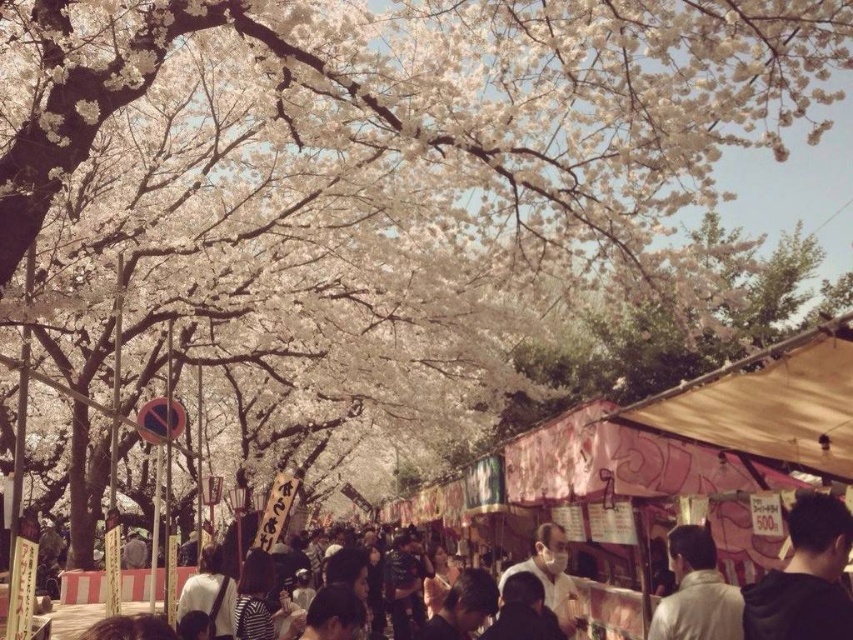
Question: Considering the real-world distances, which object is closest to the black matte hair at lower right?

Choices:
 (A) matte black mask at center
 (B) white matte jacket at center

Answer: (B)

Question: Is black matte hair at lower right below white matte jacket at center?

Choices:
 (A) no
 (B) yes

Answer: (A)

Question: Is black matte hair at lower right to the right of white matte jacket at center from the viewer's perspective?

Choices:
 (A) no
 (B) yes

Answer: (A)

Question: Considering the real-world distances, which object is closest to the black matte hair at lower right?

Choices:
 (A) matte black mask at center
 (B) white matte jacket at center

Answer: (B)

Question: Is black matte hair at lower right positioned in front of matte black mask at center?

Choices:
 (A) yes
 (B) no

Answer: (A)

Question: Which of the following is the closest to the observer?

Choices:
 (A) white matte jacket at center
 (B) black matte hair at lower right
 (C) matte black mask at center

Answer: (B)